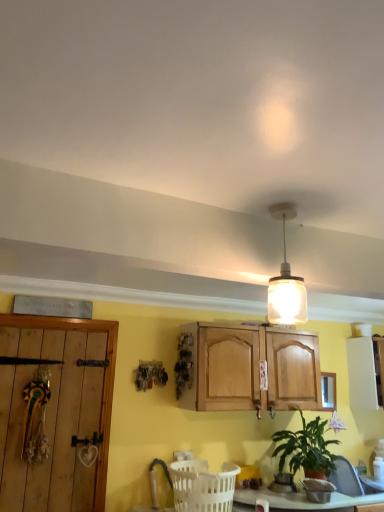
Question: Could you tell me if white plastic basket at lower center is facing white matte cabinet at right?

Choices:
 (A) yes
 (B) no

Answer: (B)

Question: Is white plastic basket at lower center closer to the viewer compared to white matte cabinet at right?

Choices:
 (A) yes
 (B) no

Answer: (A)

Question: Is white matte cabinet at right a part of white plastic basket at lower center?

Choices:
 (A) no
 (B) yes

Answer: (A)

Question: Does white plastic basket at lower center have a larger size compared to white matte cabinet at right?

Choices:
 (A) no
 (B) yes

Answer: (A)

Question: From a real-world perspective, is white plastic basket at lower center positioned under white matte cabinet at right based on gravity?

Choices:
 (A) yes
 (B) no

Answer: (A)

Question: From the image's perspective, is white plastic basket at lower center below white matte cabinet at right?

Choices:
 (A) no
 (B) yes

Answer: (B)

Question: From a real-world perspective, is white matte cabinet at right under green matte plant at lower right?

Choices:
 (A) no
 (B) yes

Answer: (A)

Question: Is white matte cabinet at right further to camera compared to green matte plant at lower right?

Choices:
 (A) no
 (B) yes

Answer: (B)

Question: From the image's perspective, is white matte cabinet at right located beneath green matte plant at lower right?

Choices:
 (A) no
 (B) yes

Answer: (A)

Question: Can you confirm if white matte cabinet at right is taller than green matte plant at lower right?

Choices:
 (A) no
 (B) yes

Answer: (B)

Question: Is white matte cabinet at right aimed at green matte plant at lower right?

Choices:
 (A) no
 (B) yes

Answer: (A)

Question: Are white matte cabinet at right and green matte plant at lower right beside each other?

Choices:
 (A) yes
 (B) no

Answer: (B)

Question: From the image's perspective, is white plastic basket at lower center located beneath green matte plant at lower right?

Choices:
 (A) no
 (B) yes

Answer: (B)